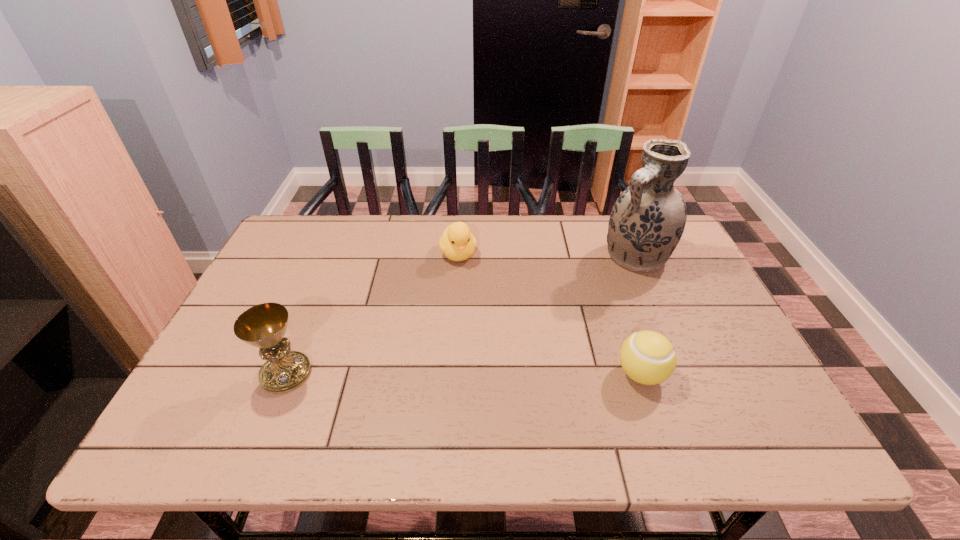
Locate an element on the screen. The width and height of the screenshot is (960, 540). object that is positioned at the far right corner is located at coordinates (647, 221).

In the image, there is a desktop. Identify the location of free space at the far edge. The width and height of the screenshot is (960, 540). (386, 219).

You are a GUI agent. You are given a task and a screenshot of the screen. Output one action in this format:
    pyautogui.click(x=<x>, y=<y>)
    Task: Click on the free space at the near edge of the desktop
    The height and width of the screenshot is (540, 960).
    Given the screenshot: What is the action you would take?
    pyautogui.click(x=671, y=377)

Image resolution: width=960 pixels, height=540 pixels. I want to click on free spot at the left edge of the desktop, so click(x=265, y=275).

In order to click on vacant space at the right edge in this screenshot , I will do `click(708, 372)`.

Locate an element on the screen. The width and height of the screenshot is (960, 540). vacant area at the far left corner of the desktop is located at coordinates (267, 258).

At what (x,y) coordinates should I click in order to perform the action: click on free space between the third shortest object and the tennis ball. Please return your answer as a coordinate pair (x, y). Looking at the image, I should click on click(464, 374).

This screenshot has height=540, width=960. What are the coordinates of `vacant region between the duck and the chalice` in the screenshot? It's located at (372, 314).

In order to click on empty space between the third object from right to left and the vase in this screenshot , I will do `click(547, 255)`.

Find the location of a particular element. The width and height of the screenshot is (960, 540). free space that is in between the duck and the vase is located at coordinates (547, 255).